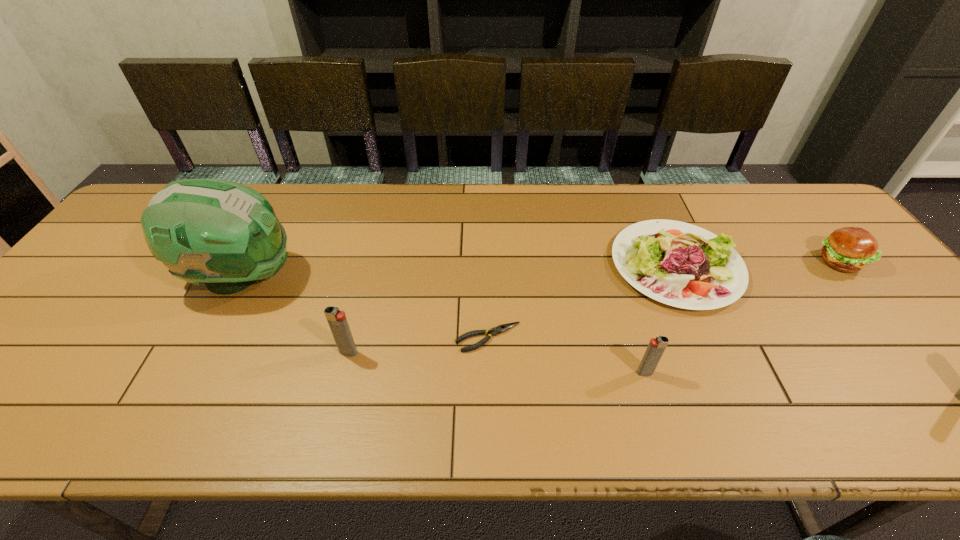
Given the evenly spaced igniters in the image, where should an extra igniter be added on the left to preserve the spacing? Please point to a vacant space. Please provide its 2D coordinates. Your answer should be formatted as a tuple, i.e. [(x, y)], where the tuple contains the x and y coordinates of a point satisfying the conditions above.

[(74, 333)]